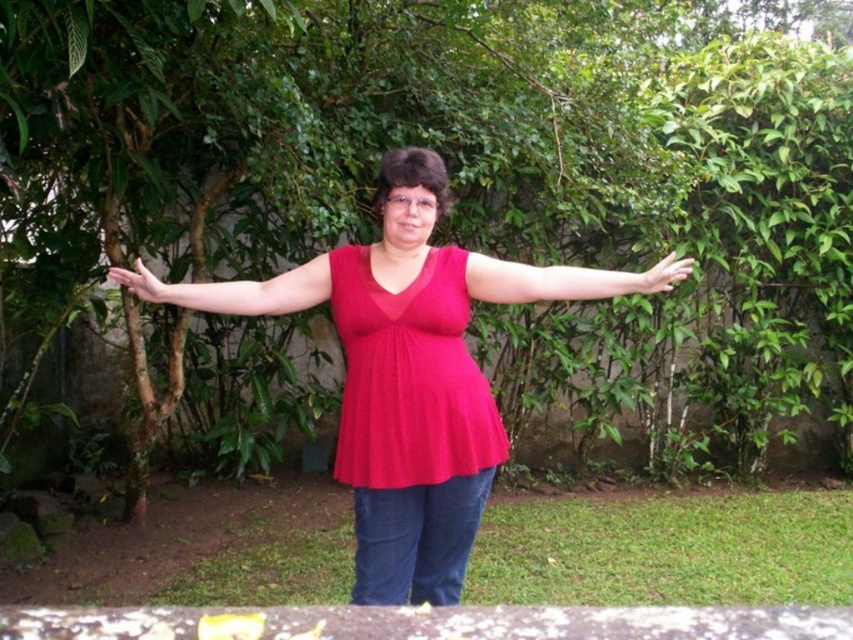
Question: Based on their relative distances, which object is farther from the pale skin hand at right?

Choices:
 (A) matte red sleeve at center
 (B) matte red blouse at center
 (C) matte red shirt at center
 (D) matte red hand at left

Answer: (D)

Question: Estimate the real-world distances between objects in this image. Which object is farther from the matte red blouse at center?

Choices:
 (A) pale skin hand at right
 (B) matte red hand at left
 (C) matte red shirt at center

Answer: (A)

Question: Can you confirm if matte red hand at left is positioned below pale skin hand at right?

Choices:
 (A) yes
 (B) no

Answer: (B)

Question: Does matte red blouse at center appear under matte red sleeve at center?

Choices:
 (A) no
 (B) yes

Answer: (B)

Question: Which of the following is the farthest from the observer?

Choices:
 (A) (387, 426)
 (B) (155, 285)
 (C) (486, 260)

Answer: (B)

Question: Is matte red hand at left smaller than pale skin hand at right?

Choices:
 (A) no
 (B) yes

Answer: (B)